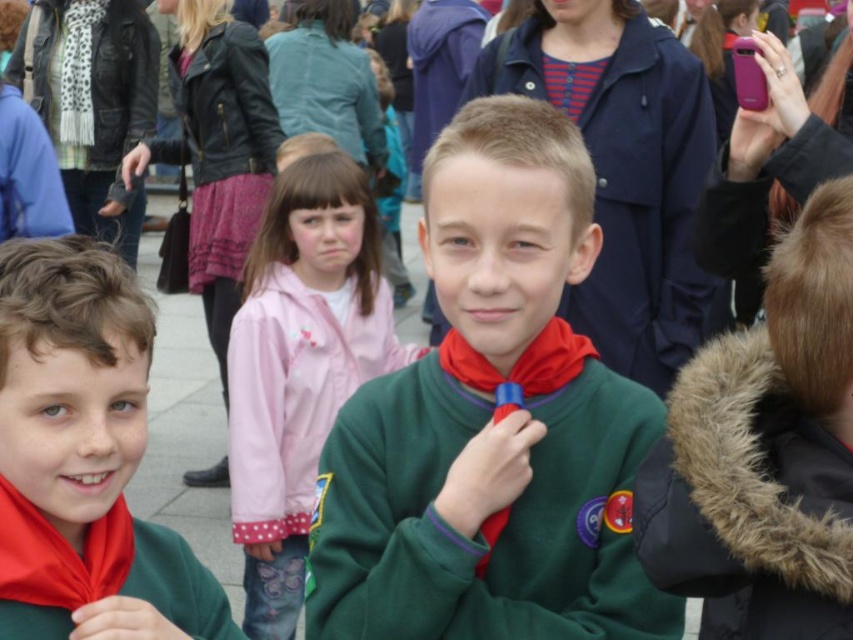
Is point (273, 525) positioned behind point (70, 508)?

That is True.

Who is taller, green fleece jacket at center or matte green sweater at center?

With more height is green fleece jacket at center.

You are a GUI agent. You are given a task and a screenshot of the screen. Output one action in this format:
    pyautogui.click(x=<x>, y=<y>)
    Task: Click on the green fleece jacket at center
    
    Given the screenshot: What is the action you would take?
    pyautogui.click(x=299, y=368)

Is green fleece sweater at center shorter than green fleece jacket at center?

Correct, green fleece sweater at center is not as tall as green fleece jacket at center.

Can you confirm if green fleece sweater at center is thinner than green fleece jacket at center?

No, green fleece sweater at center is not thinner than green fleece jacket at center.

The height and width of the screenshot is (640, 853). Identify the location of green fleece sweater at center. (491, 422).

Which is more to the left, green fleece sweater at center or matte green sweater at center?

From the viewer's perspective, matte green sweater at center appears more on the left side.

How far apart are green fleece sweater at center and matte green sweater at center?

green fleece sweater at center is 7.42 feet away from matte green sweater at center.

This screenshot has height=640, width=853. What do you see at coordinates (491, 422) in the screenshot?
I see `green fleece sweater at center` at bounding box center [491, 422].

At what (x,y) coordinates should I click in order to perform the action: click on green fleece sweater at center. Please return your answer as a coordinate pair (x, y). Looking at the image, I should click on (491, 422).